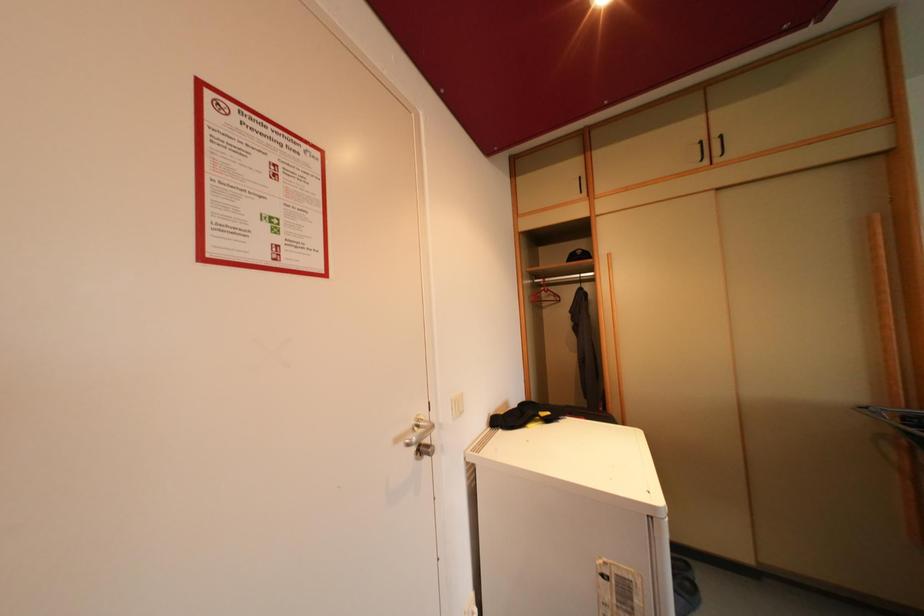
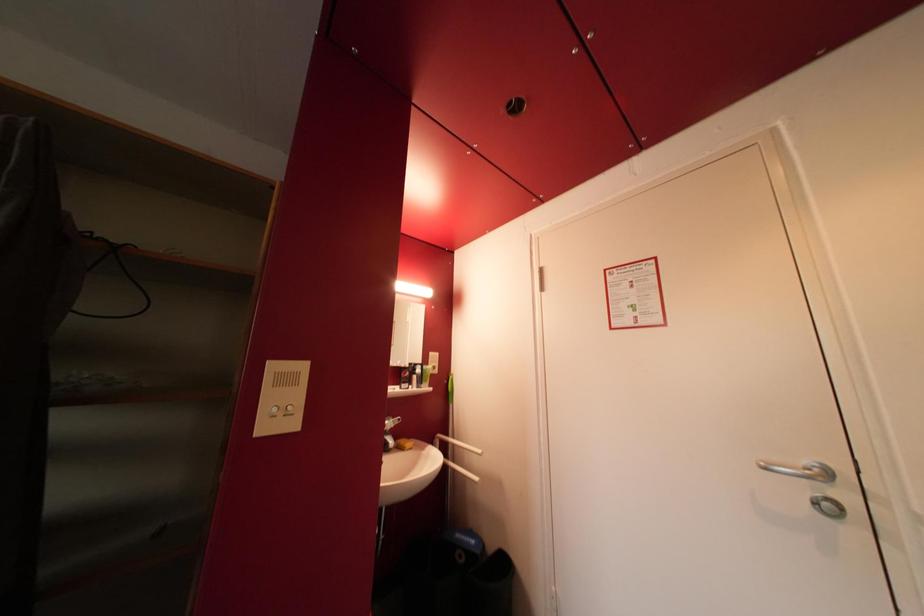
Question: Based on the continuous images, in which direction is the camera rotating? Reply with the corresponding letter.

Choices:
 (A) Left
 (B) Right
 (C) Up
 (D) Down

Answer: (A)